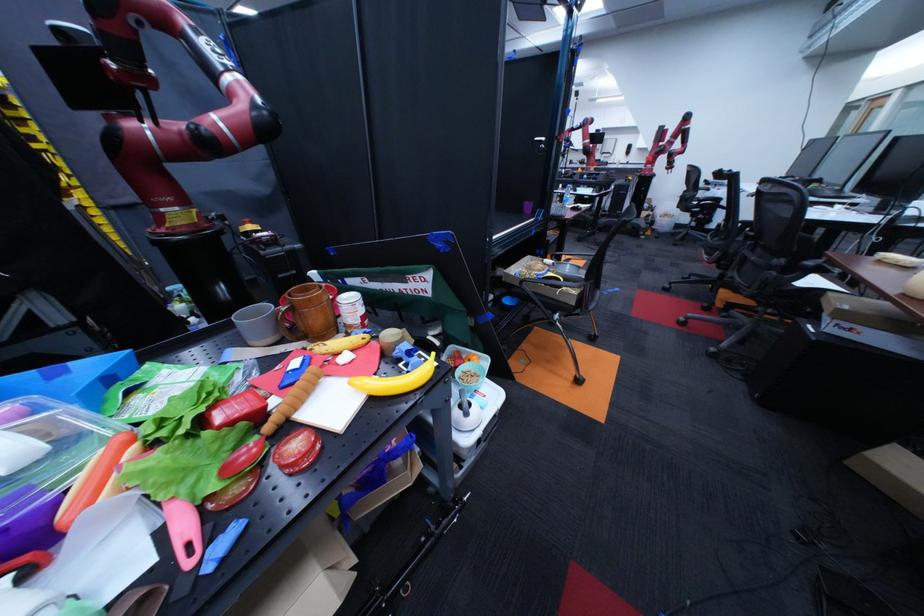
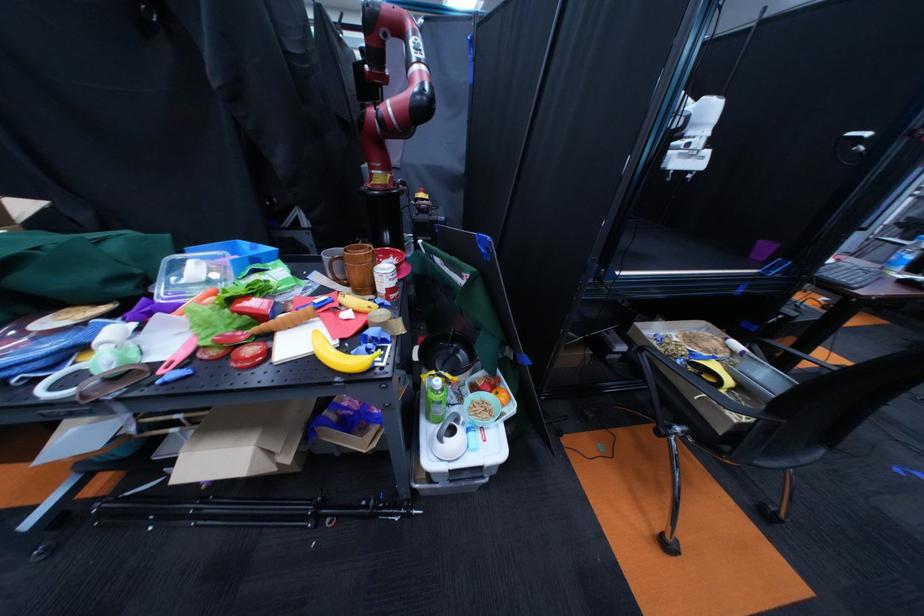
The point at (612, 293) is marked in the first image. Where is the corresponding point in the second image?

(835, 451)